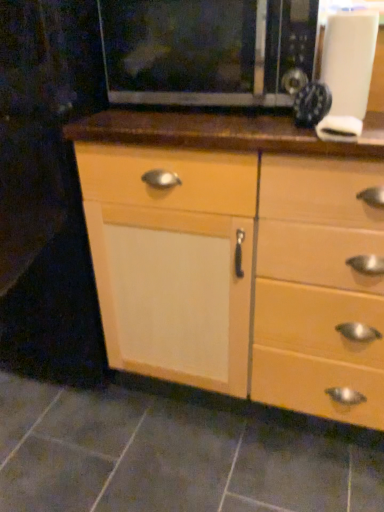
Describe the element at coordinates (208, 51) in the screenshot. I see `black matte microwave at upper center` at that location.

This screenshot has width=384, height=512. I want to click on metallic black clock at upper right, so click(312, 104).

The height and width of the screenshot is (512, 384). What do you see at coordinates (170, 457) in the screenshot?
I see `gray tile at lower center` at bounding box center [170, 457].

I want to click on gray tile at lower center, so click(170, 457).

Identify the location of wooden cabinet at center. (241, 256).

Does black matte microwave at upper center have a lesser height compared to white matte knob at upper right?

No.

Find the location of a particular element. The image size is (384, 512). microwave behind the white matte knob at upper right is located at coordinates (208, 51).

Between point (211, 70) and point (330, 117), which one is positioned in front?

Positioned in front is point (330, 117).

How distant is black matte microwave at upper center from white matte knob at upper right?

black matte microwave at upper center is 13.33 inches away from white matte knob at upper right.

Does white matte knob at upper right have a smaller size compared to gray tile at lower center?

Yes.

In order to click on knob on the right of gray tile at lower center in this screenshot , I will do `click(339, 129)`.

Is white matte knob at upper right oriented away from gray tile at lower center?

No.

In the image, is white matte knob at upper right positioned in front of or behind gray tile at lower center?

In the image, white matte knob at upper right appears in front of gray tile at lower center.

What's the angular difference between black matte microwave at upper center and wooden cabinet at center's facing directions?

black matte microwave at upper center and wooden cabinet at center are facing 0.992 degrees away from each other.

Between point (281, 84) and point (199, 188), which one is positioned behind?

Point (199, 188)

Is black matte microwave at upper center facing away from wooden cabinet at center?

black matte microwave at upper center does not have its back to wooden cabinet at center.

From the image's perspective, who appears lower, white matte knob at upper right or metallic black clock at upper right?

white matte knob at upper right is shown below in the image.

Which of these two, white matte knob at upper right or metallic black clock at upper right, stands taller?

With more height is metallic black clock at upper right.

Could you tell me if white matte knob at upper right is facing metallic black clock at upper right?

No, white matte knob at upper right is not aimed at metallic black clock at upper right.

Considering the sizes of objects gray tile at lower center and metallic black clock at upper right in the image provided, who is wider, gray tile at lower center or metallic black clock at upper right?

gray tile at lower center.

From the image's perspective, would you say gray tile at lower center is positioned over metallic black clock at upper right?

Incorrect, from the image's perspective, gray tile at lower center is lower than metallic black clock at upper right.

Is gray tile at lower center oriented away from metallic black clock at upper right?

No, gray tile at lower center's orientation is not away from metallic black clock at upper right.

Which is behind, point (166, 443) or point (324, 92)?

The point (166, 443) is farther from the camera.

How far apart are wooden cabinet at center and black matte microwave at upper center?

wooden cabinet at center and black matte microwave at upper center are 13.67 inches apart.

Is the depth of wooden cabinet at center greater than that of black matte microwave at upper center?

No, wooden cabinet at center is in front of black matte microwave at upper center.

From the image's perspective, is wooden cabinet at center located beneath black matte microwave at upper center?

Indeed, from the image's perspective, wooden cabinet at center is shown beneath black matte microwave at upper center.

Is wooden cabinet at center positioned with its back to black matte microwave at upper center?

No.

Is wooden cabinet at center inside or outside of gray tile at lower center?

wooden cabinet at center is spatially situated outside gray tile at lower center.

Which object is closer to the camera, wooden cabinet at center or gray tile at lower center?

wooden cabinet at center is closer to the camera.

Are wooden cabinet at center and gray tile at lower center beside each other?

No, wooden cabinet at center is not in contact with gray tile at lower center.

Image resolution: width=384 pixels, height=512 pixels. I want to click on microwave that is behind the white matte knob at upper right, so click(208, 51).

This screenshot has width=384, height=512. In order to click on knob located on the right of gray tile at lower center in this screenshot , I will do `click(339, 129)`.

Looking at the image, which one is located closer to metallic black clock at upper right, white matte knob at upper right or black matte microwave at upper center?

white matte knob at upper right is positioned closer to the anchor metallic black clock at upper right.

Considering their positions, is gray tile at lower center positioned closer to black matte microwave at upper center than white matte knob at upper right?

white matte knob at upper right lies closer to black matte microwave at upper center than the other object.

Looking at the image, which one is located further to black matte microwave at upper center, gray tile at lower center or wooden cabinet at center?

The object further to black matte microwave at upper center is gray tile at lower center.

Considering their positions, is white matte knob at upper right positioned closer to wooden cabinet at center than gray tile at lower center?

white matte knob at upper right is positioned closer to the anchor wooden cabinet at center.

Based on their spatial positions, is white matte knob at upper right or gray tile at lower center closer to black matte microwave at upper center?

white matte knob at upper right is closer to black matte microwave at upper center.

In the scene shown: Based on their spatial positions, is wooden cabinet at center or gray tile at lower center closer to metallic black clock at upper right?

wooden cabinet at center.

From the image, which object appears to be farther from gray tile at lower center, black matte microwave at upper center or white matte knob at upper right?

The object further to gray tile at lower center is black matte microwave at upper center.

When comparing their distances from metallic black clock at upper right, does wooden cabinet at center or white matte knob at upper right seem closer?

white matte knob at upper right lies closer to metallic black clock at upper right than the other object.

The height and width of the screenshot is (512, 384). I want to click on appliance between black matte microwave at upper center and white matte knob at upper right vertically, so click(312, 104).

Find the location of a particular element. The height and width of the screenshot is (512, 384). knob that lies between metallic black clock at upper right and wooden cabinet at center from top to bottom is located at coordinates (339, 129).

The image size is (384, 512). I want to click on chest of drawers between metallic black clock at upper right and gray tile at lower center in the up-down direction, so click(x=241, y=256).

The height and width of the screenshot is (512, 384). I want to click on appliance between black matte microwave at upper center and gray tile at lower center in the vertical direction, so click(x=312, y=104).